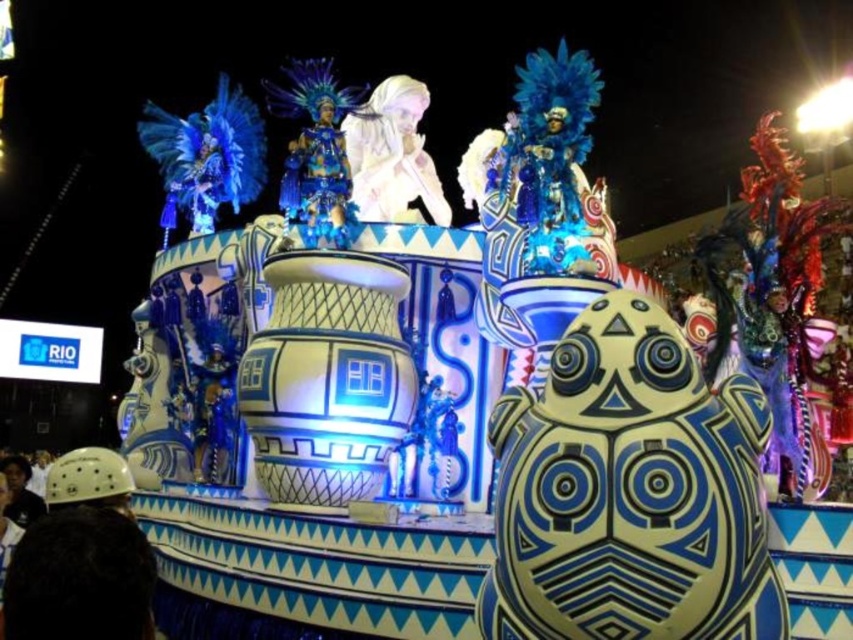
Question: Is white matte hair at upper center bigger than shiny blue costume at center?

Choices:
 (A) no
 (B) yes

Answer: (B)

Question: Where is white matte hair at upper center located in relation to shiny blue costume at center in the image?

Choices:
 (A) left
 (B) right

Answer: (B)

Question: Among these objects, which one is farthest from the camera?

Choices:
 (A) white matte hair at upper center
 (B) shiny blue costume at center

Answer: (A)

Question: Does white matte hair at upper center appear on the right side of shiny blue costume at center?

Choices:
 (A) yes
 (B) no

Answer: (A)

Question: Which of the following is the closest to the observer?

Choices:
 (A) shiny blue costume at center
 (B) white matte hair at upper center

Answer: (A)